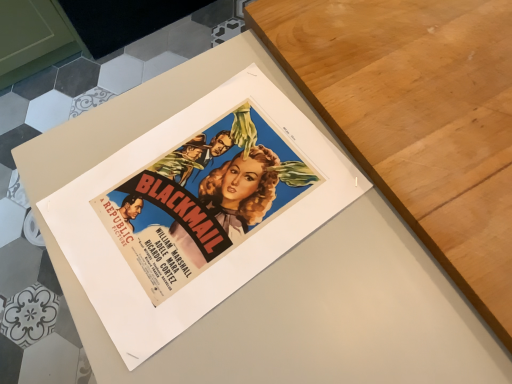
Where is `free point above wooden table at upper right (from a real-world perspective)`? The image size is (512, 384). free point above wooden table at upper right (from a real-world perspective) is located at coordinates pyautogui.click(x=432, y=83).